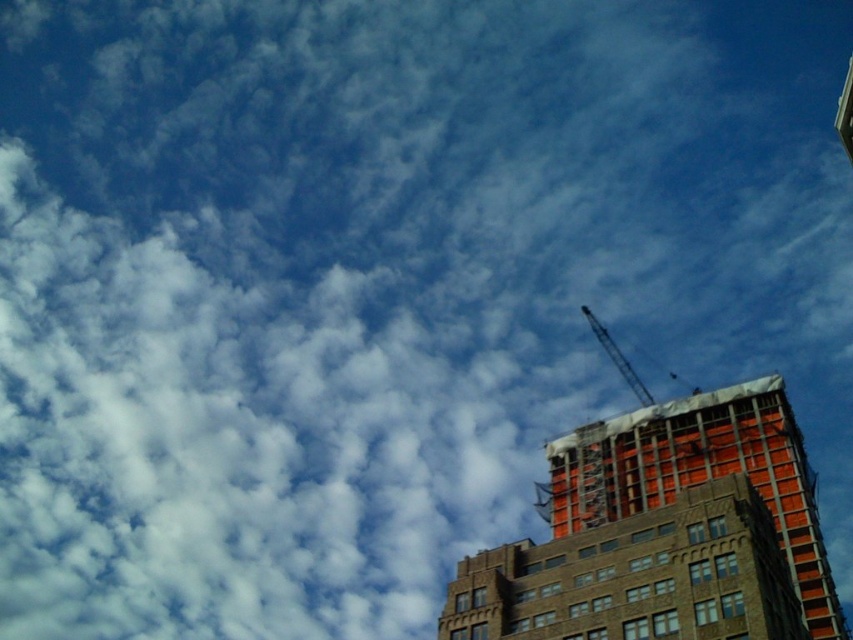
Does point (641, 428) come behind point (631, 371)?

That is False.

Who is taller, orange brick building at upper right or metallic gray crane at upper right?

Standing taller between the two is metallic gray crane at upper right.

Measure the distance between orange brick building at upper right and camera.

orange brick building at upper right is 60.89 meters from camera.

Image resolution: width=853 pixels, height=640 pixels. In order to click on orange brick building at upper right in this screenshot , I will do `click(700, 476)`.